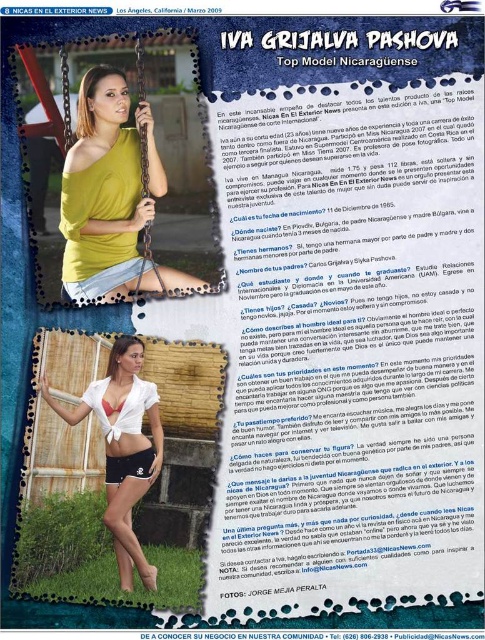
You are a fashion designer reviewing the magazine layout. You notice the mustard yellow jersey at center and the black matte shorts at lower center. Which piece of clothing is positioned higher on the model?

The mustard yellow jersey at center is much taller than the black matte shorts at lower center, so the mustard yellow jersey at center is positioned higher on the model.

You are a fashion designer reviewing the magazine layout. You notice the mustard yellow jersey at center and the black matte shorts at lower center. Which of these two items appears bigger in the image?

The mustard yellow jersey at center appears bigger than the black matte shorts at lower center in the image.